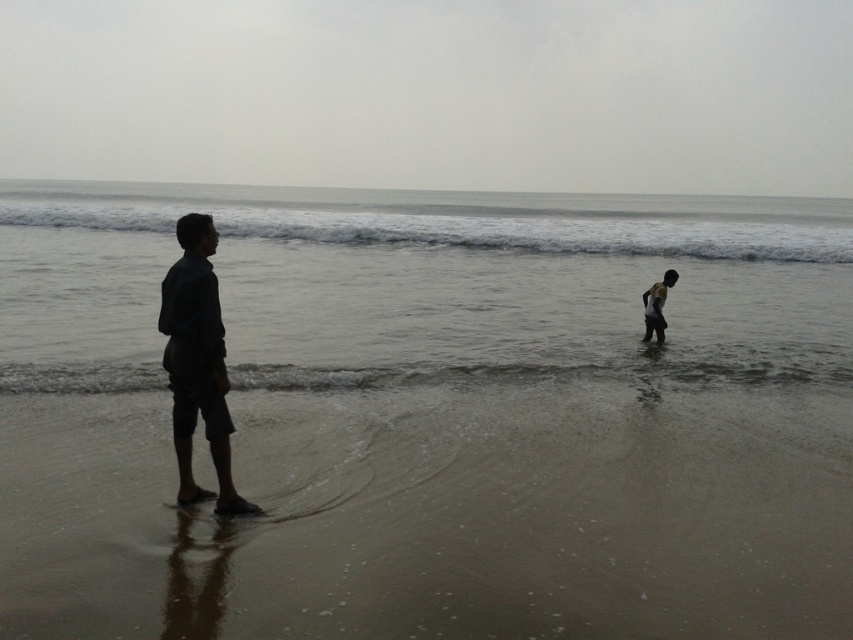
You are a photographer trying to capture a photo of the dark blue fabric shirt at left and the dark skin child at lower right. Which object is positioned lower in the frame?

The dark blue fabric shirt at left is located below the dark skin child at lower right, so it is positioned lower in the frame.

Based on the photo, you are standing on the beach and see the clear water at center and the dark blue fabric shirt at left. Which object is closer to you?

The clear water at center is closer to you because it is further to the viewer than the dark blue fabric shirt at left.

You are a photographer trying to capture the scene. You want to ensure that the clear water at center and the dark blue fabric shirt at left are both visible in your shot. Based on their positions, which object is closer to the camera?

The clear water at center is closer to the camera because it is above the dark blue fabric shirt at left, indicating a higher position in the frame.